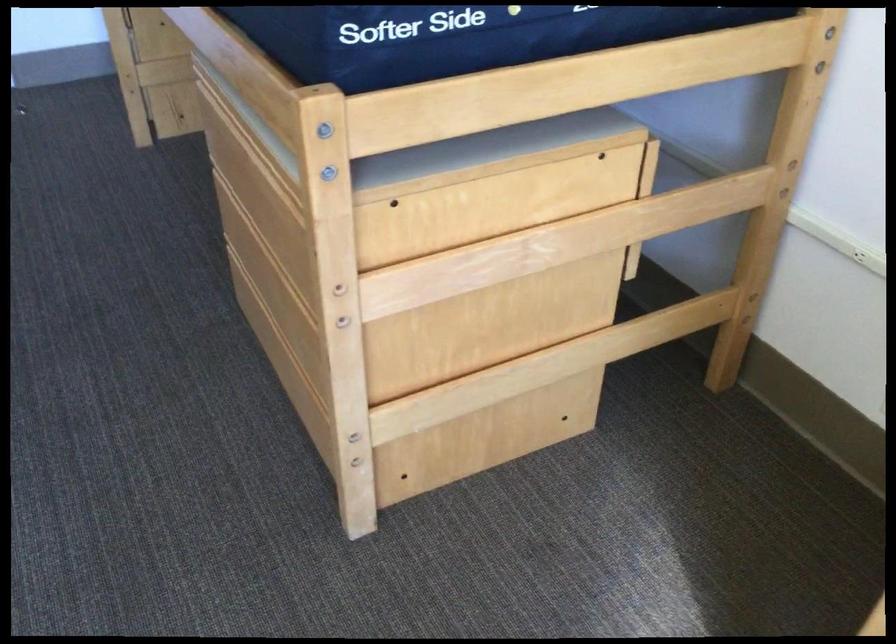
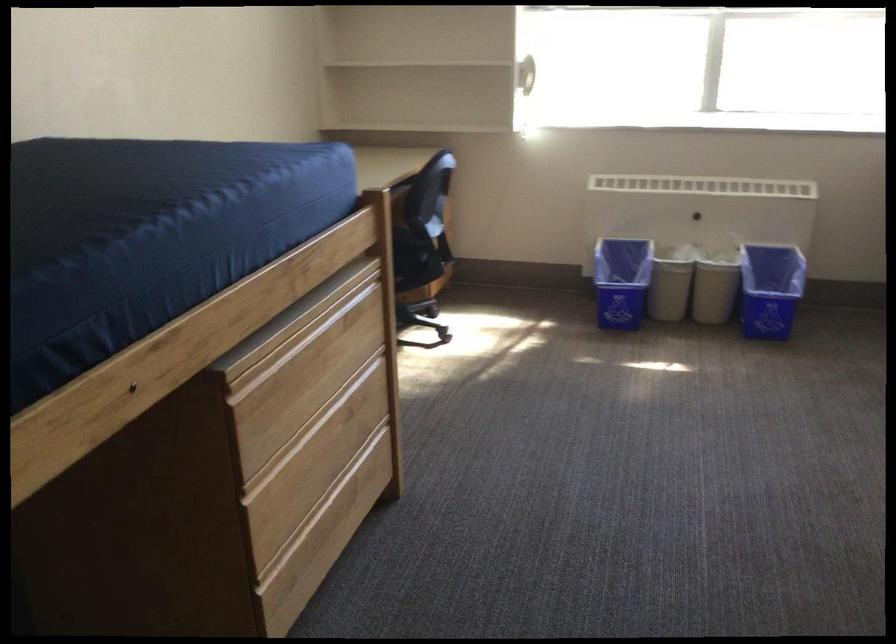
Find the pixel in the second image that matches (x=283, y=366) in the first image.

(330, 523)